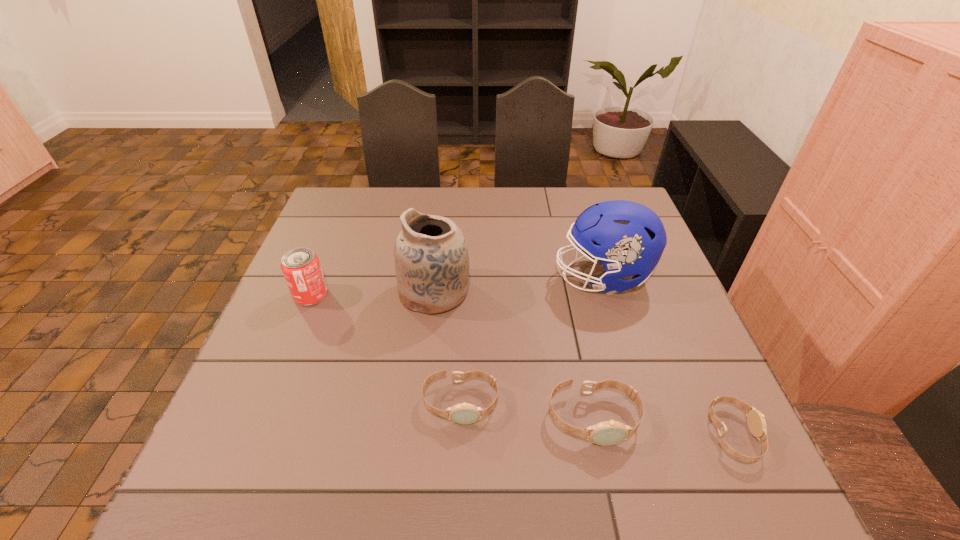
The height and width of the screenshot is (540, 960). In order to click on the fifth tallest object in this screenshot , I will do pyautogui.click(x=464, y=413).

Where is `the second tallest watch`? Image resolution: width=960 pixels, height=540 pixels. the second tallest watch is located at coordinates (464, 413).

Identify the location of the second watch from right to left. The image size is (960, 540). (606, 433).

At what (x,y) coordinates should I click in order to perform the action: click on the shortest watch. Please return your answer as a coordinate pair (x, y). Looking at the image, I should click on (756, 422).

Find the location of a particular element. This screenshot has width=960, height=540. the shortest object is located at coordinates (756, 422).

In order to click on football helmet in this screenshot , I will do `click(627, 238)`.

Identify the location of pottery. (431, 257).

You are a GUI agent. You are given a task and a screenshot of the screen. Output one action in this format:
    pyautogui.click(x=<x>, y=<y>)
    Task: Click on the third tallest object
    
    Given the screenshot: What is the action you would take?
    pyautogui.click(x=301, y=268)

I want to click on the leftmost object, so click(301, 268).

This screenshot has width=960, height=540. In order to click on free location located on the face guard of the football helmet in this screenshot , I will do `click(487, 276)`.